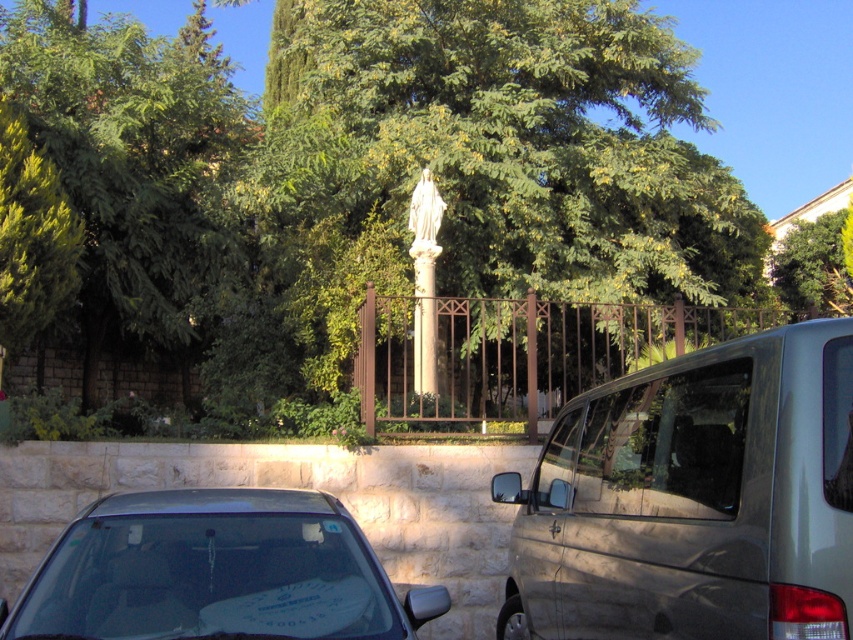
Question: Is green leafy tree at upper left to the right of green leafy tree at upper right from the viewer's perspective?

Choices:
 (A) yes
 (B) no

Answer: (B)

Question: Which object appears closest to the camera in this image?

Choices:
 (A) satin silver van at center
 (B) brown wrought iron fence at center
 (C) green leafy tree at upper right
 (D) matte black car at lower left

Answer: (A)

Question: Can you confirm if green leafy tree at center is bigger than matte black car at lower left?

Choices:
 (A) yes
 (B) no

Answer: (B)

Question: Which object is the farthest from the satin silver van at center?

Choices:
 (A) green leafy tree at upper right
 (B) brown wrought iron fence at center
 (C) green leafy tree at upper left

Answer: (C)

Question: Considering the relative positions of matte black car at lower left and green leafy tree at upper right in the image provided, where is matte black car at lower left located with respect to green leafy tree at upper right?

Choices:
 (A) above
 (B) below

Answer: (B)

Question: Based on their relative distances, which object is farther from the green leafy tree at upper right?

Choices:
 (A) transparent plastic license plate at lower right
 (B) satin silver van at center
 (C) green leafy tree at upper left

Answer: (A)